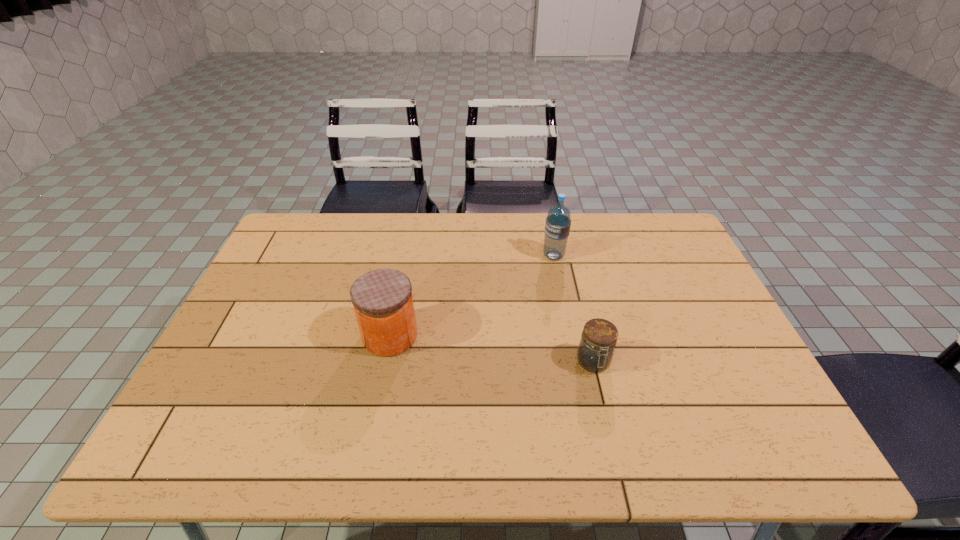
Identify the location of the tallest object. (558, 221).

You are a GUI agent. You are given a task and a screenshot of the screen. Output one action in this format:
    pyautogui.click(x=<x>, y=<y>)
    Task: Click on the farthest object
    
    Given the screenshot: What is the action you would take?
    pyautogui.click(x=558, y=221)

At what (x,y) coordinates should I click in order to perform the action: click on the second tallest object. Please return your answer as a coordinate pair (x, y). The image size is (960, 540). Looking at the image, I should click on (382, 299).

Find the location of `the left jar`. the left jar is located at coordinates (382, 299).

At what (x,y) coordinates should I click in order to perform the action: click on the shorter jar. Please return your answer as a coordinate pair (x, y). Looking at the image, I should click on (595, 352).

Where is `the right jar`? The image size is (960, 540). the right jar is located at coordinates (595, 352).

Find the location of `free space located on the right of the tallest object`. free space located on the right of the tallest object is located at coordinates (618, 256).

Identify the location of free space located 0.140m on the back of the second shortest object. (400, 282).

Find the location of a particular element. This screenshot has height=540, width=960. vacant space situated 0.090m on the lid of the shorter jar is located at coordinates (605, 411).

Where is `object located at the far edge`? This screenshot has height=540, width=960. object located at the far edge is located at coordinates (558, 221).